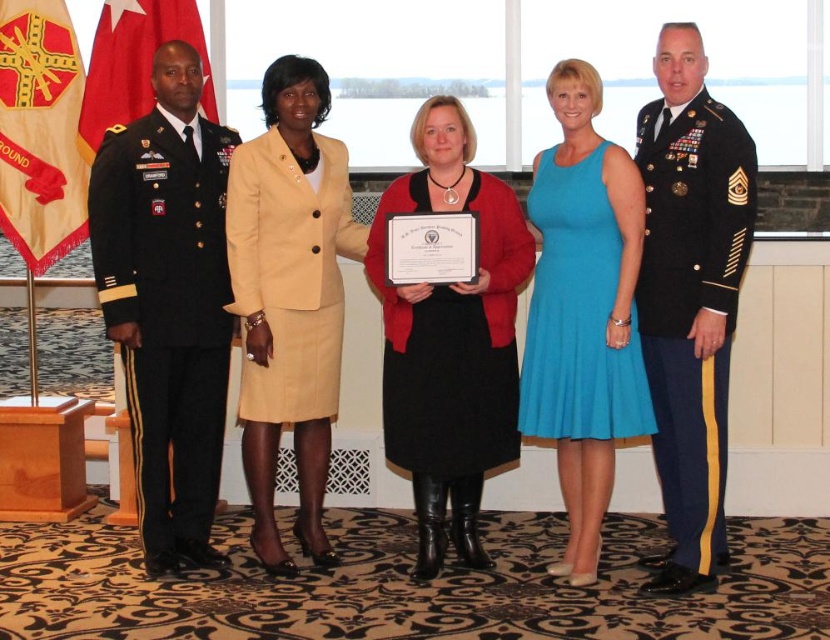
Question: Is turquoise fabric dress at center thinner than red flag at left?

Choices:
 (A) yes
 (B) no

Answer: (A)

Question: Among these points, which one is farthest from the camera?

Choices:
 (A) (113, 116)
 (B) (470, 392)

Answer: (A)

Question: Observing the image, what is the correct spatial positioning of dark green military uniform at right in reference to beige fabric skirt suit at center?

Choices:
 (A) right
 (B) left

Answer: (A)

Question: Is gold/yellow fabric flag at left bigger than red flag at left?

Choices:
 (A) yes
 (B) no

Answer: (B)

Question: Which object is positioned farthest from the gold/yellow fabric flag at left?

Choices:
 (A) black matte dress at center
 (B) turquoise fabric dress at center
 (C) dark green military uniform at right

Answer: (C)

Question: Among these objects, which one is nearest to the camera?

Choices:
 (A) black matte dress at center
 (B) beige fabric skirt suit at center
 (C) red flag at left
 (D) turquoise fabric dress at center

Answer: (D)